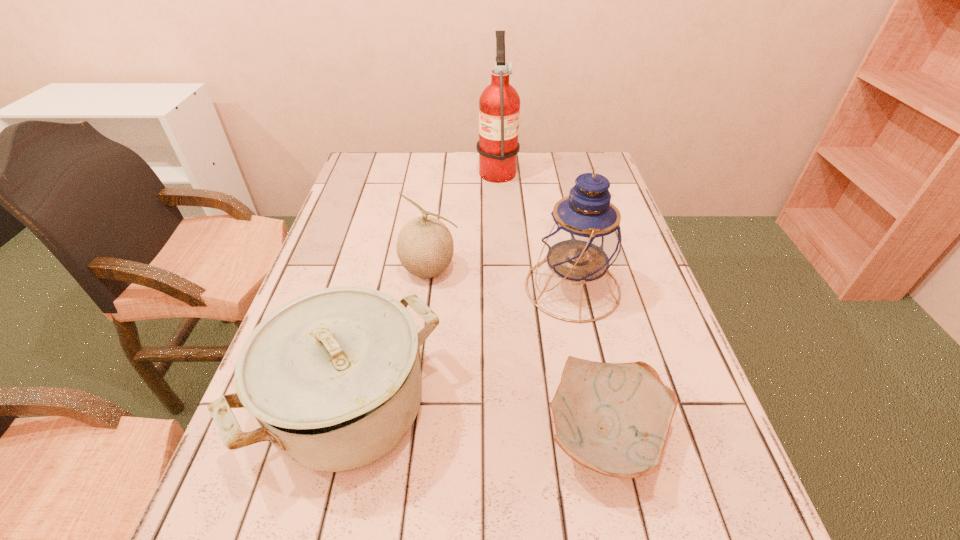
Where is `fire extinguisher`? fire extinguisher is located at coordinates (499, 104).

Locate an element on the screen. the tallest object is located at coordinates (499, 104).

This screenshot has width=960, height=540. What are the coordinates of `lantern` in the screenshot? It's located at (582, 239).

Locate an element on the screen. Image resolution: width=960 pixels, height=540 pixels. cantaloup is located at coordinates (425, 247).

Locate an element on the screen. The width and height of the screenshot is (960, 540). saucepan is located at coordinates (333, 377).

The width and height of the screenshot is (960, 540). Identify the location of the shortest object. (613, 418).

You are a GUI agent. You are given a task and a screenshot of the screen. Output one action in this format:
    pyautogui.click(x=<x>, y=<y>)
    Task: Click on the free region located 0.150m on the nozzle and handle of the fire extinguisher
    The image size is (960, 540).
    Given the screenshot: What is the action you would take?
    pyautogui.click(x=432, y=169)

You are a GUI agent. You are given a task and a screenshot of the screen. Output one action in this format:
    pyautogui.click(x=<x>, y=<y>)
    Task: Click on the vacant position located on the nozzle and handle of the fire extinguisher
    The image size is (960, 540).
    Given the screenshot: What is the action you would take?
    pyautogui.click(x=415, y=169)

This screenshot has width=960, height=540. In order to click on free location located 0.220m on the nozzle and handle of the fire extinguisher in this screenshot , I will do `click(412, 169)`.

Find the location of `free region located 0.330m on the front-facing side of the fourth shortest object`. free region located 0.330m on the front-facing side of the fourth shortest object is located at coordinates (390, 288).